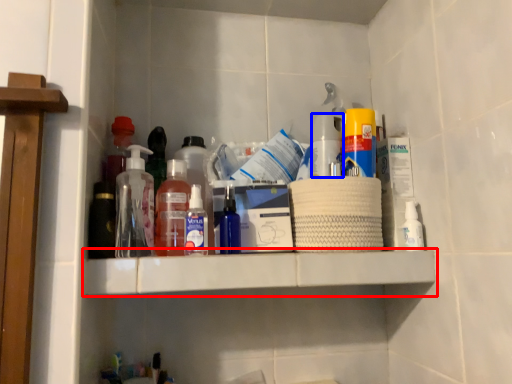
Question: Which object appears farthest to the camera in this image, shelf (highlighted by a red box) or bottle (highlighted by a blue box)?

Choices:
 (A) shelf
 (B) bottle

Answer: (B)